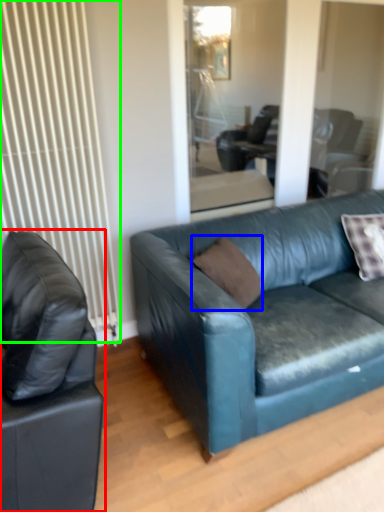
Question: Which object is positioned farthest from studio couch (highlighted by a red box)? Select from pillow (highlighted by a blue box) and radiator (highlighted by a green box).

Choices:
 (A) pillow
 (B) radiator

Answer: (A)